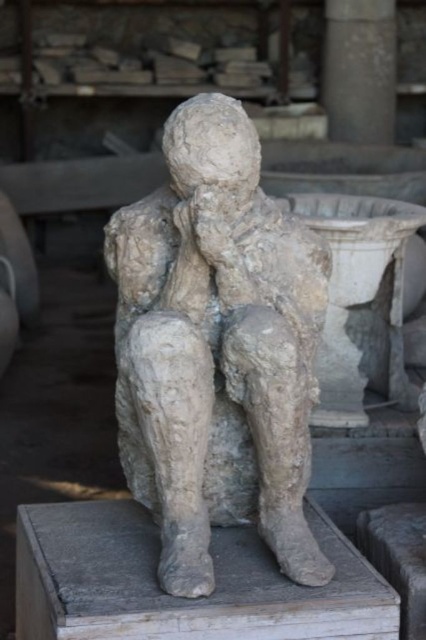
Is gray stone statue at center positioned behind smooth gray stone pillar at upper center?

No, gray stone statue at center is in front of smooth gray stone pillar at upper center.

Can you confirm if gray stone statue at center is shorter than smooth gray stone pillar at upper center?

No, gray stone statue at center is not shorter than smooth gray stone pillar at upper center.

You are a GUI agent. You are given a task and a screenshot of the screen. Output one action in this format:
    pyautogui.click(x=<x>, y=<y>)
    Task: Click on the gray stone statue at center
    This screenshot has height=640, width=426.
    Given the screenshot: What is the action you would take?
    pyautogui.click(x=216, y=349)